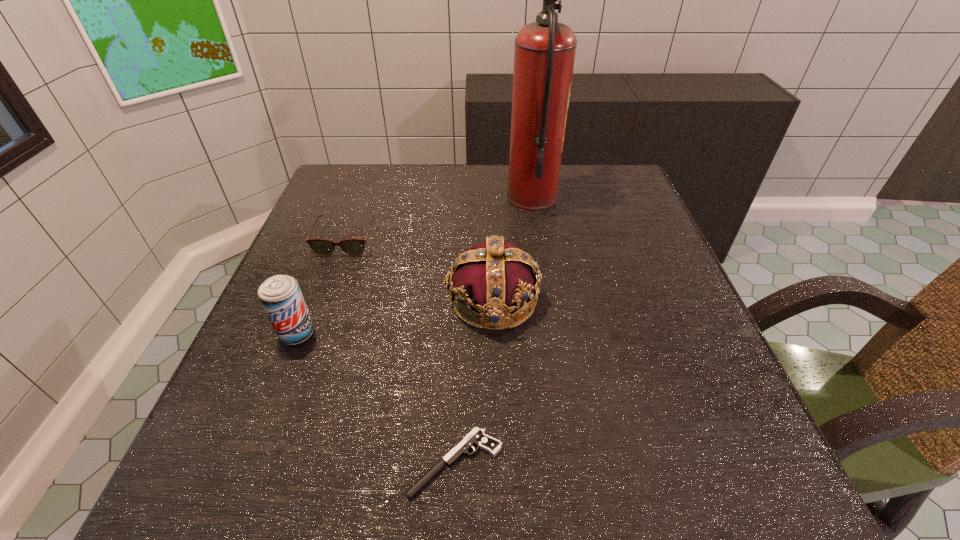
The image size is (960, 540). I want to click on vacant region between the spectacles and the farthest object, so click(439, 219).

I want to click on empty location between the beer can and the tallest object, so point(415,266).

Locate an element on the screen. Image resolution: width=960 pixels, height=540 pixels. free space between the crown and the spectacles is located at coordinates (420, 270).

Locate an element on the screen. This screenshot has width=960, height=540. vacant area that lies between the spectacles and the pistol is located at coordinates (400, 352).

Image resolution: width=960 pixels, height=540 pixels. What are the coordinates of `vacant area that lies between the third tallest object and the fourth tallest object` in the screenshot? It's located at (322, 287).

The width and height of the screenshot is (960, 540). Identify the location of free space that is in between the spectacles and the pistol. (400, 352).

Find the location of a particular element. free space between the beer can and the nearest object is located at coordinates (376, 398).

The image size is (960, 540). Identify the location of free space between the tallest object and the shortest object. (493, 330).

At what (x,y) coordinates should I click in order to perform the action: click on the third closest object to the second shortest object. Please return your answer as a coordinate pair (x, y). Looking at the image, I should click on (544, 55).

Find the location of a particular element. the second closest object to the beer can is located at coordinates (494, 278).